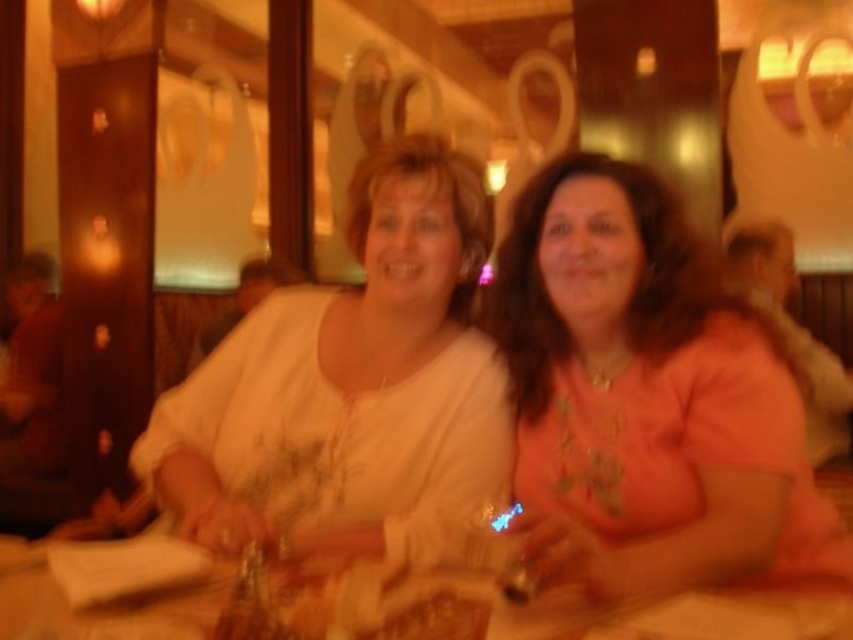
Consider the image. You are an interior designer analyzing the layout of this dining area. The white satin blouse at center is positioned at coordinates 0.608, 0.414. How would you describe its placement relative to the table?

The white satin blouse at center is located at coordinates (352, 388), which places it slightly to the right and above the center of the table.

You are standing in the restaurant and want to place a small vase exactly at the point marked as point (706, 364). If the vase is 1 foot tall, will it fit without exceeding the table height?

The point (706, 364) and viewer are 3.83 feet apart, but there is no information provided about the table height or the vase dimensions relative to the table. Therefore, it is impossible to determine if the vase will fit without exceeding the table height based on the given information.